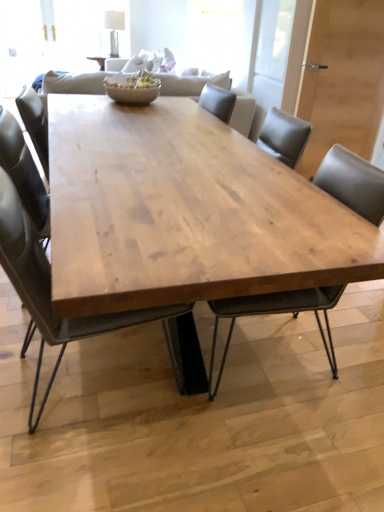
Question: Is matte brown bowl at center closer to the viewer compared to matte wood chair at center, which appears as the 2th chair when viewed from the left?

Choices:
 (A) yes
 (B) no

Answer: (B)

Question: Is matte brown bowl at center located outside matte wood chair at center, which appears as the 2th chair when viewed from the left?

Choices:
 (A) no
 (B) yes

Answer: (B)

Question: Is matte brown bowl at center positioned with its back to matte wood chair at center, the 1th chair viewed from the right?

Choices:
 (A) yes
 (B) no

Answer: (B)

Question: Is matte brown bowl at center taller than matte wood chair at center, which appears as the 2th chair when viewed from the left?

Choices:
 (A) yes
 (B) no

Answer: (B)

Question: From a real-world perspective, does matte brown bowl at center stand above matte wood chair at center, which appears as the 2th chair when viewed from the left?

Choices:
 (A) yes
 (B) no

Answer: (A)

Question: From a real-world perspective, is matte wood chair at center, which appears as the 2th chair when viewed from the left, positioned above or below matte brown bowl at center?

Choices:
 (A) above
 (B) below

Answer: (B)

Question: Is point (317, 320) closer or farther from the camera than point (120, 78)?

Choices:
 (A) farther
 (B) closer

Answer: (B)

Question: Considering the relative positions of matte wood chair at center, the 1th chair viewed from the right, and matte brown bowl at center in the image provided, is matte wood chair at center, the 1th chair viewed from the right, to the left or to the right of matte brown bowl at center?

Choices:
 (A) right
 (B) left

Answer: (A)

Question: From the image's perspective, relative to matte brown bowl at center, is matte wood chair at center, which appears as the 2th chair when viewed from the left, above or below?

Choices:
 (A) below
 (B) above

Answer: (A)

Question: Is point (24, 266) closer or farther from the camera than point (192, 338)?

Choices:
 (A) closer
 (B) farther

Answer: (A)

Question: From the image's perspective, is matte black chair at center, the first chair when ordered from left to right, positioned above or below natural wood table at center?

Choices:
 (A) below
 (B) above

Answer: (A)

Question: From a real-world perspective, relative to natural wood table at center, is matte black chair at center, the second chair when ordered from right to left, vertically above or below?

Choices:
 (A) below
 (B) above

Answer: (B)

Question: Based on their sizes in the image, would you say matte black chair at center, the first chair when ordered from left to right, is bigger or smaller than natural wood table at center?

Choices:
 (A) big
 (B) small

Answer: (B)

Question: Is point (208, 282) closer or farther from the camera than point (127, 98)?

Choices:
 (A) closer
 (B) farther

Answer: (A)

Question: Considering the relative positions of natural wood table at center and matte brown bowl at center in the image provided, is natural wood table at center to the left or to the right of matte brown bowl at center?

Choices:
 (A) left
 (B) right

Answer: (B)